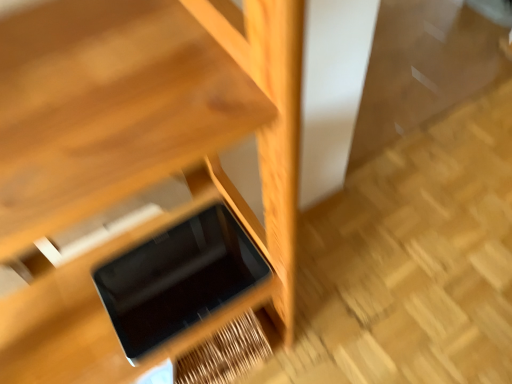
Question: Should I look upward or downward to see black plastic ipad at center?

Choices:
 (A) down
 (B) up

Answer: (A)